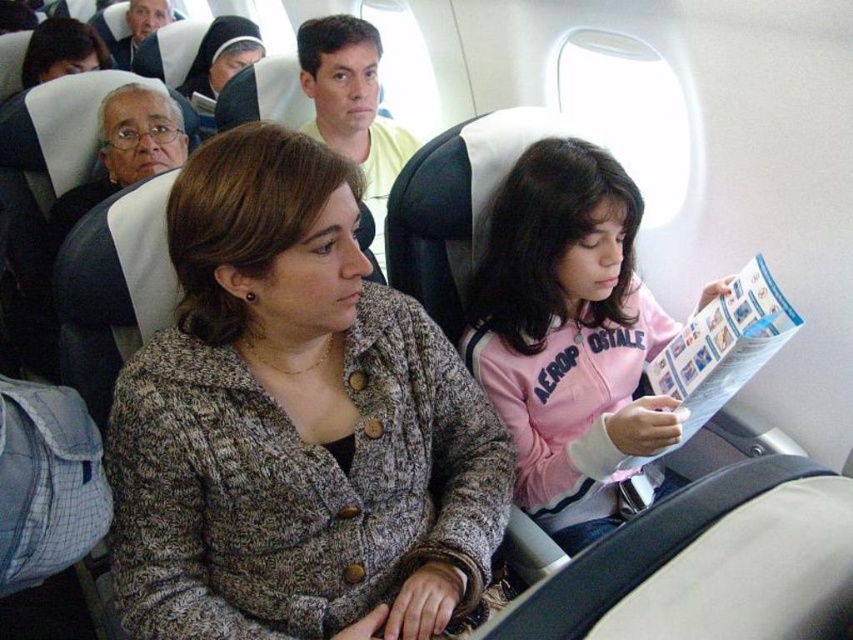
In the scene shown: You are a flight attendant checking passengers clothing for a safety demonstration. You see a passenger wearing a knitted gray sweater at center and another wearing a yellow cotton shirt at center. Which clothing item is positioned lower on their body?

The knitted gray sweater at center is positioned lower on their body because it is below the yellow cotton shirt at center.

You are a flight attendant carrying a tray of snacks. You need to place a snack on the knitted gray sweater at center and another snack on the blue glossy magazine at center right. Can you fit both snacks without them overlapping?

The knitted gray sweater at center and blue glossy magazine at center right are 49.65 centimeters apart, so yes, you can place the snacks on both without overlapping since the distance between them is sufficient.